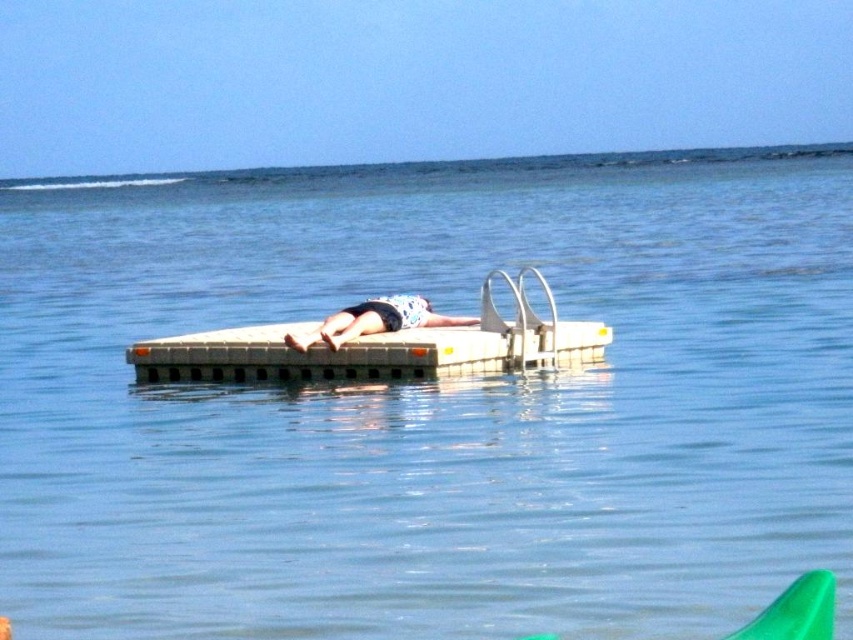
Question: Which point is farther to the camera?

Choices:
 (A) (474, 333)
 (B) (344, 316)

Answer: (B)

Question: Is white plastic boat at center below floral fabric towel at center?

Choices:
 (A) yes
 (B) no

Answer: (A)

Question: Does white plastic boat at center appear on the left side of floral fabric towel at center?

Choices:
 (A) no
 (B) yes

Answer: (A)

Question: Which point appears farthest from the camera in this image?

Choices:
 (A) (279, 376)
 (B) (354, 314)

Answer: (A)

Question: Which point is closer to the camera?

Choices:
 (A) white plastic boat at center
 (B) floral fabric towel at center

Answer: (B)

Question: Does white plastic boat at center appear under floral fabric towel at center?

Choices:
 (A) yes
 (B) no

Answer: (A)